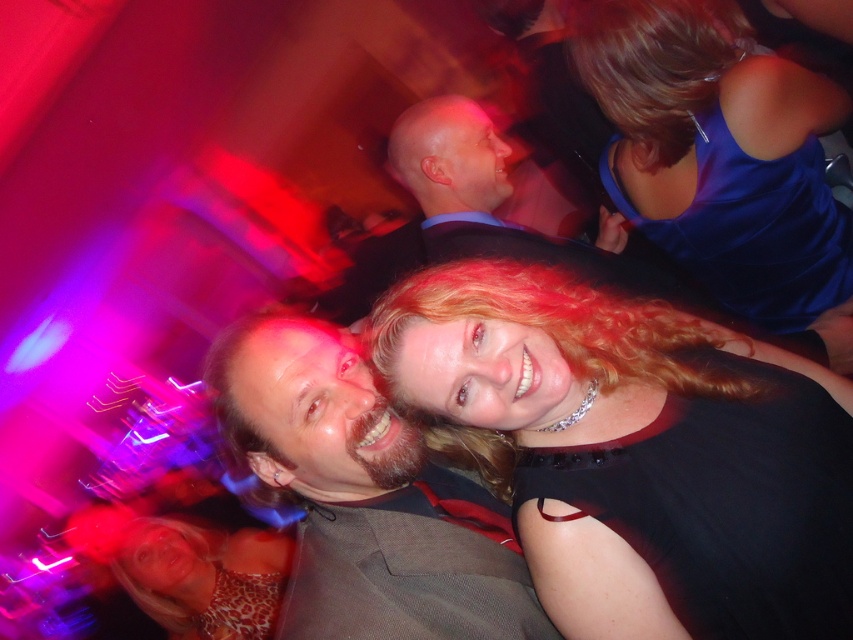
You are a photographer at the event and want to capture a photo of both the shiny black dress at center and the shiny black suit at center. Which one should you focus on if you want to highlight the lower part of the outfit?

The shiny black dress at center is shorter than the shiny black suit at center, so focusing on the shiny black suit at center would better highlight the lower part of the outfit since it extends lower than the dress.

You are a photographer standing in the crowd at the event. You want to take a closeup shot of the dark brown leather jacket at center without moving too far. Can you reach it within 3 feet?

The dark brown leather jacket at center is 3.32 feet away from viewer, so you cannot reach it within 3 feet as it is slightly farther away.